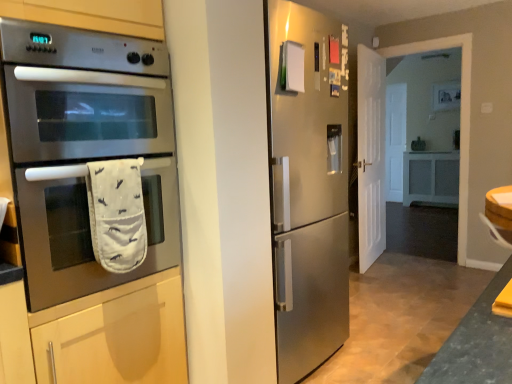
At what (x,y) coordinates should I click in order to perform the action: click on vacant area that is in front of white matte door at right. Please return your answer as a coordinate pair (x, y). Image resolution: width=512 pixels, height=384 pixels. Looking at the image, I should click on (379, 276).